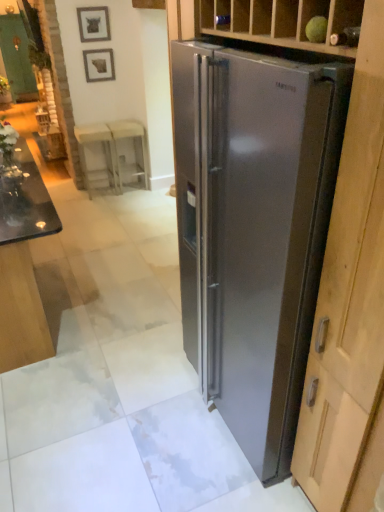
In order to face matte gray picture frame at upper left, which is counted as the 2th picture frame, starting from the top, should I rotate leftwards or rightwards?

Turn left approximately 12.209 degrees to face it.

The height and width of the screenshot is (512, 384). Describe the element at coordinates (99, 65) in the screenshot. I see `matte gray picture frame at upper left, which is counted as the 2th picture frame, starting from the top` at that location.

Find the location of a particular element. This screenshot has width=384, height=512. white plastic stool at center, the 1th stool when ordered from left to right is located at coordinates (104, 152).

Describe the element at coordinates (17, 58) in the screenshot. The height and width of the screenshot is (512, 384). I see `green matte glass door at upper left` at that location.

What do you see at coordinates (129, 137) in the screenshot?
I see `white plastic stool at center, which is counted as the first stool, starting from the right` at bounding box center [129, 137].

Locate an element on the screen. The image size is (384, 512). black glass table at lower left is located at coordinates 23,264.

Describe the element at coordinates (23, 264) in the screenshot. The height and width of the screenshot is (512, 384). I see `black glass table at lower left` at that location.

The width and height of the screenshot is (384, 512). Find the location of `stainless steel refrigerator at right`. stainless steel refrigerator at right is located at coordinates (254, 229).

Is metallic silver picture frame at upper center, which is the 1th picture frame from top to bottom, at the back of stainless steel refrigerator at right?

No, metallic silver picture frame at upper center, which is the 1th picture frame from top to bottom, is not at the back of stainless steel refrigerator at right.

From the image's perspective, which is above, stainless steel refrigerator at right or metallic silver picture frame at upper center, the second picture frame positioned from the bottom?

From the image's view, metallic silver picture frame at upper center, the second picture frame positioned from the bottom, is above.

Is metallic silver picture frame at upper center, the second picture frame positioned from the bottom, a part of stainless steel refrigerator at right?

No.

How many degrees apart are the facing directions of stainless steel refrigerator at right and metallic silver picture frame at upper center, the second picture frame positioned from the bottom?

The angular difference between stainless steel refrigerator at right and metallic silver picture frame at upper center, the second picture frame positioned from the bottom, is 90.6 degrees.

Can you confirm if green matte glass door at upper left is smaller than black glass table at lower left?

Correct, green matte glass door at upper left occupies less space than black glass table at lower left.

Is green matte glass door at upper left far from black glass table at lower left?

Yes, green matte glass door at upper left and black glass table at lower left are quite far apart.

In the scene shown: How many degrees apart are the facing directions of green matte glass door at upper left and black glass table at lower left?

The angular difference between green matte glass door at upper left and black glass table at lower left is 91.6 degrees.

From the image's perspective, between green matte glass door at upper left and black glass table at lower left, which one is located above?

green matte glass door at upper left appears higher in the image.

Considering the positions of point (94, 10) and point (144, 138), is point (94, 10) closer or farther from the camera than point (144, 138)?

Point (94, 10) appears to be closer to the viewer than point (144, 138).

Does metallic silver picture frame at upper center, the second picture frame positioned from the bottom, have a larger size compared to white plastic stool at center, which is counted as the first stool, starting from the right?

Incorrect, metallic silver picture frame at upper center, the second picture frame positioned from the bottom, is not larger than white plastic stool at center, which is counted as the first stool, starting from the right.

Does metallic silver picture frame at upper center, which is the 1th picture frame from top to bottom, come in front of white plastic stool at center, placed as the 2th stool when sorted from left to right?

Yes, metallic silver picture frame at upper center, which is the 1th picture frame from top to bottom, is closer to the viewer.

Can you confirm if metallic silver picture frame at upper center, which is the 1th picture frame from top to bottom, is positioned to the right of white plastic stool at center, which is counted as the first stool, starting from the right?

No.

From the image's perspective, does stainless steel refrigerator at right appear lower than white plastic stool at center, which is counted as the first stool, starting from the right?

Indeed, from the image's perspective, stainless steel refrigerator at right is shown beneath white plastic stool at center, which is counted as the first stool, starting from the right.

Between stainless steel refrigerator at right and white plastic stool at center, which is counted as the first stool, starting from the right, which one is positioned in front?

Answer: stainless steel refrigerator at right is in front.

Do you think stainless steel refrigerator at right is within white plastic stool at center, placed as the 2th stool when sorted from left to right, or outside of it?

stainless steel refrigerator at right is spatially situated outside white plastic stool at center, placed as the 2th stool when sorted from left to right.

Is stainless steel refrigerator at right at the right side of black glass table at lower left?

Yes.

Choose the correct answer: Is stainless steel refrigerator at right inside black glass table at lower left or outside it?

stainless steel refrigerator at right cannot be found inside black glass table at lower left.

Image resolution: width=384 pixels, height=512 pixels. I want to click on refrigerator on the right of the black glass table at lower left, so click(x=254, y=229).

Does stainless steel refrigerator at right have a smaller size compared to black glass table at lower left?

Incorrect, stainless steel refrigerator at right is not smaller in size than black glass table at lower left.

Which object is more forward, green matte glass door at upper left or metallic silver picture frame at upper center, which is the 1th picture frame from top to bottom?

metallic silver picture frame at upper center, which is the 1th picture frame from top to bottom, is more forward.

Is the surface of green matte glass door at upper left in direct contact with metallic silver picture frame at upper center, the second picture frame positioned from the bottom?

No, green matte glass door at upper left is not making contact with metallic silver picture frame at upper center, the second picture frame positioned from the bottom.

Based on the photo, how distant is green matte glass door at upper left from metallic silver picture frame at upper center, the second picture frame positioned from the bottom?

green matte glass door at upper left and metallic silver picture frame at upper center, the second picture frame positioned from the bottom, are 3.40 meters apart from each other.

Identify the location of the 1st picture frame to the right of the green matte glass door at upper left, starting your count from the anchor. (93, 24).

What's the angular difference between white plastic stool at center, placed as the 2th stool when sorted from left to right, and white plastic stool at center, the 1th stool when ordered from left to right,'s facing directions?

The facing directions of white plastic stool at center, placed as the 2th stool when sorted from left to right, and white plastic stool at center, the 1th stool when ordered from left to right, are 0.00145 degrees apart.

Is white plastic stool at center, which is counted as the first stool, starting from the right, positioned with its back to white plastic stool at center, the 1th stool when ordered from left to right?

No.

You are a GUI agent. You are given a task and a screenshot of the screen. Output one action in this format:
    pyautogui.click(x=<x>, y=<y>)
    Task: Click on the stool above the white plastic stool at center, marked as the second stool in a right-to-left arrangement (from a real-world perspective)
    
    Given the screenshot: What is the action you would take?
    pyautogui.click(x=129, y=137)

Between white plastic stool at center, placed as the 2th stool when sorted from left to right, and white plastic stool at center, marked as the second stool in a right-to-left arrangement, which one has more height?

With more height is white plastic stool at center, placed as the 2th stool when sorted from left to right.

Identify the location of refrigerator that is in front of the metallic silver picture frame at upper center, the second picture frame positioned from the bottom. The width and height of the screenshot is (384, 512). (254, 229).

The image size is (384, 512). I want to click on table below the green matte glass door at upper left (from a real-world perspective), so click(x=23, y=264).

Considering their positions, is matte gray picture frame at upper left, which is counted as the 2th picture frame, starting from the top, positioned closer to black glass table at lower left than white plastic stool at center, marked as the second stool in a right-to-left arrangement?

white plastic stool at center, marked as the second stool in a right-to-left arrangement, is closer to black glass table at lower left.

Based on their spatial positions, is white plastic stool at center, marked as the second stool in a right-to-left arrangement, or green matte glass door at upper left further from black glass table at lower left?

Based on the image, green matte glass door at upper left appears to be further to black glass table at lower left.

Estimate the real-world distances between objects in this image. Which object is closer to stainless steel refrigerator at right, white plastic stool at center, marked as the second stool in a right-to-left arrangement, or matte gray picture frame at upper left, which appears as the first picture frame when ordered from the bottom?

Based on the image, white plastic stool at center, marked as the second stool in a right-to-left arrangement, appears to be nearer to stainless steel refrigerator at right.

Looking at the image, which one is located further to white plastic stool at center, marked as the second stool in a right-to-left arrangement, green matte glass door at upper left or matte gray picture frame at upper left, which is counted as the 2th picture frame, starting from the top?

green matte glass door at upper left is positioned further to the anchor white plastic stool at center, marked as the second stool in a right-to-left arrangement.

Estimate the real-world distances between objects in this image. Which object is closer to green matte glass door at upper left, black glass table at lower left or white plastic stool at center, the 1th stool when ordered from left to right?

white plastic stool at center, the 1th stool when ordered from left to right, is positioned closer to the anchor green matte glass door at upper left.

Based on their spatial positions, is white plastic stool at center, which is counted as the first stool, starting from the right, or metallic silver picture frame at upper center, the second picture frame positioned from the bottom, closer to matte gray picture frame at upper left, which is counted as the 2th picture frame, starting from the top?

The object closer to matte gray picture frame at upper left, which is counted as the 2th picture frame, starting from the top, is metallic silver picture frame at upper center, the second picture frame positioned from the bottom.

From the image, which object appears to be farther from stainless steel refrigerator at right, white plastic stool at center, the 1th stool when ordered from left to right, or green matte glass door at upper left?

green matte glass door at upper left.

From the picture: Looking at the image, which one is located closer to metallic silver picture frame at upper center, the second picture frame positioned from the bottom, green matte glass door at upper left or white plastic stool at center, marked as the second stool in a right-to-left arrangement?

The object closer to metallic silver picture frame at upper center, the second picture frame positioned from the bottom, is white plastic stool at center, marked as the second stool in a right-to-left arrangement.

The image size is (384, 512). In order to click on stool between stainless steel refrigerator at right and white plastic stool at center, placed as the 2th stool when sorted from left to right, from front to back in this screenshot , I will do `click(104, 152)`.

Locate an element on the screen. This screenshot has height=512, width=384. stool between black glass table at lower left and white plastic stool at center, which is counted as the first stool, starting from the right, along the z-axis is located at coordinates (104, 152).

Locate an element on the screen. stool that lies between matte gray picture frame at upper left, which is counted as the 2th picture frame, starting from the top, and white plastic stool at center, the 1th stool when ordered from left to right, from top to bottom is located at coordinates (129, 137).

You are a GUI agent. You are given a task and a screenshot of the screen. Output one action in this format:
    pyautogui.click(x=<x>, y=<y>)
    Task: Click on the picture frame between metallic silver picture frame at upper center, which is the 1th picture frame from top to bottom, and white plastic stool at center, the 1th stool when ordered from left to right, in the up-down direction
    This screenshot has width=384, height=512.
    Given the screenshot: What is the action you would take?
    pyautogui.click(x=99, y=65)